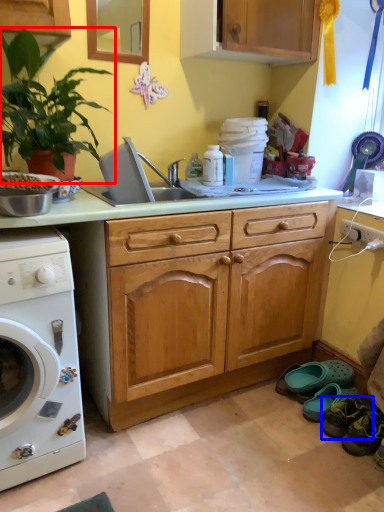
Question: Among these objects, which one is farthest to the camera, houseplant (highlighted by a red box) or shoe (highlighted by a blue box)?

Choices:
 (A) houseplant
 (B) shoe

Answer: (B)